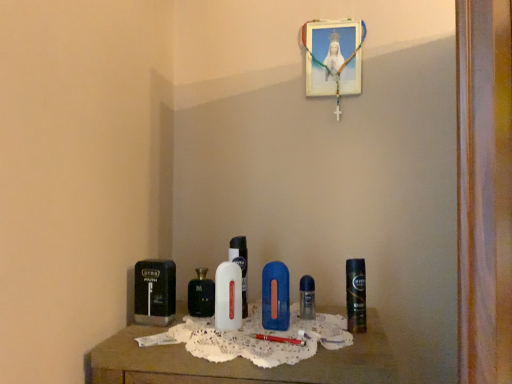
Where is `free point to the left of white plastic bottle at center, which appears as the 2th perfume when viewed from the front`? This screenshot has height=384, width=512. free point to the left of white plastic bottle at center, which appears as the 2th perfume when viewed from the front is located at coordinates (179, 323).